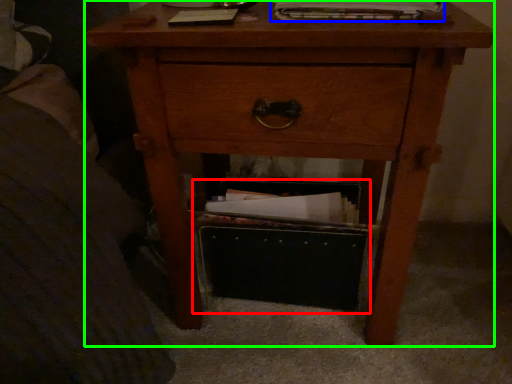
Question: Based on their relative distances, which object is farther from shoe box (highlighted by a red box)? Choose from magazine (highlighted by a blue box) and nightstand (highlighted by a green box).

Choices:
 (A) magazine
 (B) nightstand

Answer: (A)